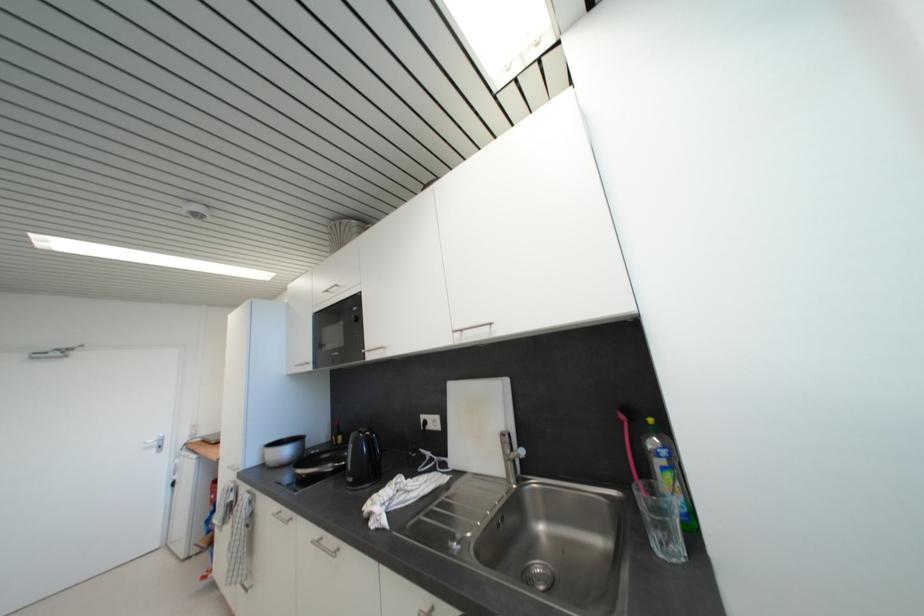
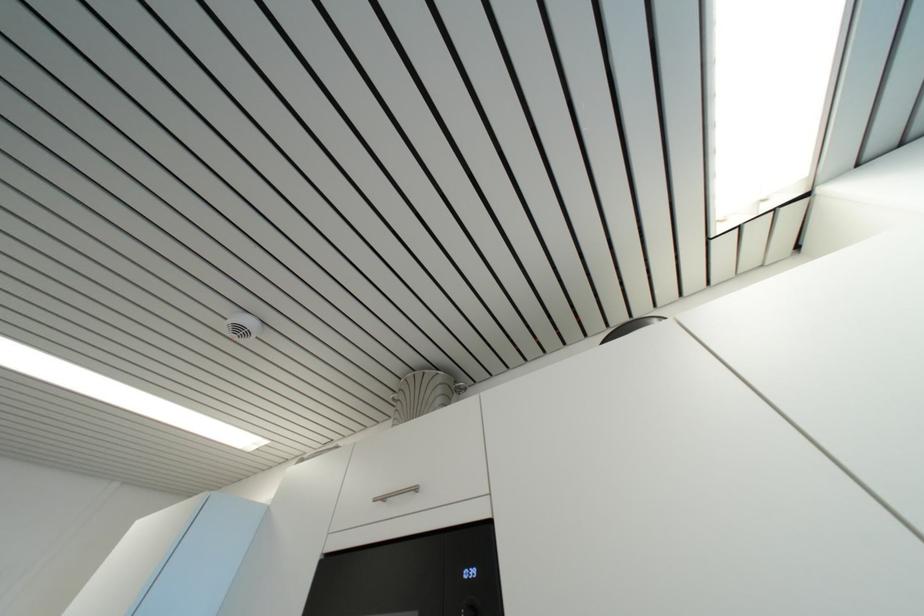
Question: Based on the continuous images, in which direction is the camera rotating? Reply with the corresponding letter.

Choices:
 (A) Left
 (B) Right
 (C) Up
 (D) Down

Answer: (C)